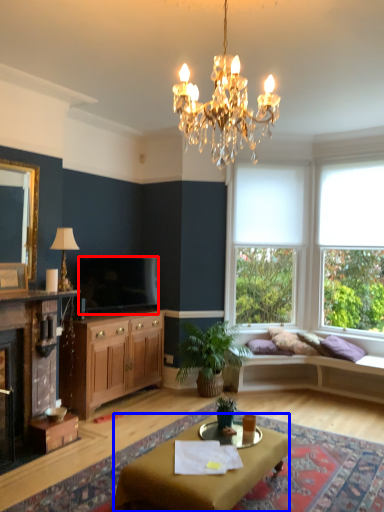
Question: Which object is further to the camera taking this photo, television (highlighted by a red box) or desk (highlighted by a blue box)?

Choices:
 (A) television
 (B) desk

Answer: (A)